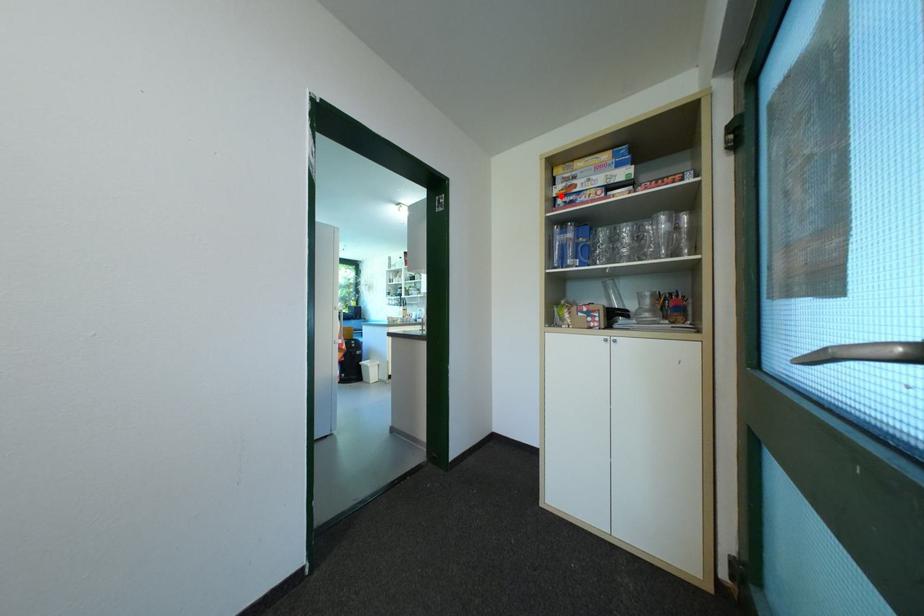
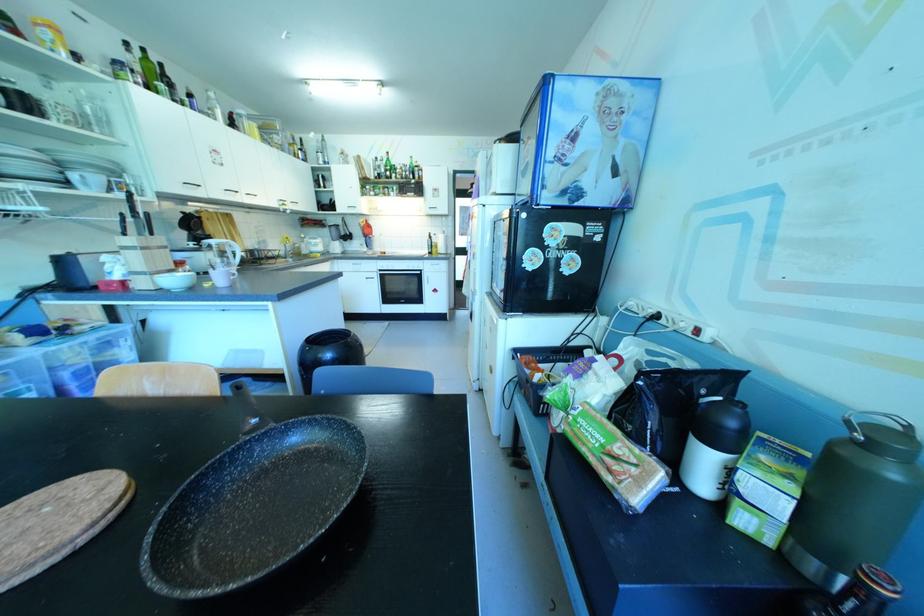
Question: I am providing you with two images of the same scene from different viewpoints. A red point is marked on the first image. Can you still see the location of the red point in image 2?

Choices:
 (A) Yes
 (B) No

Answer: (B)